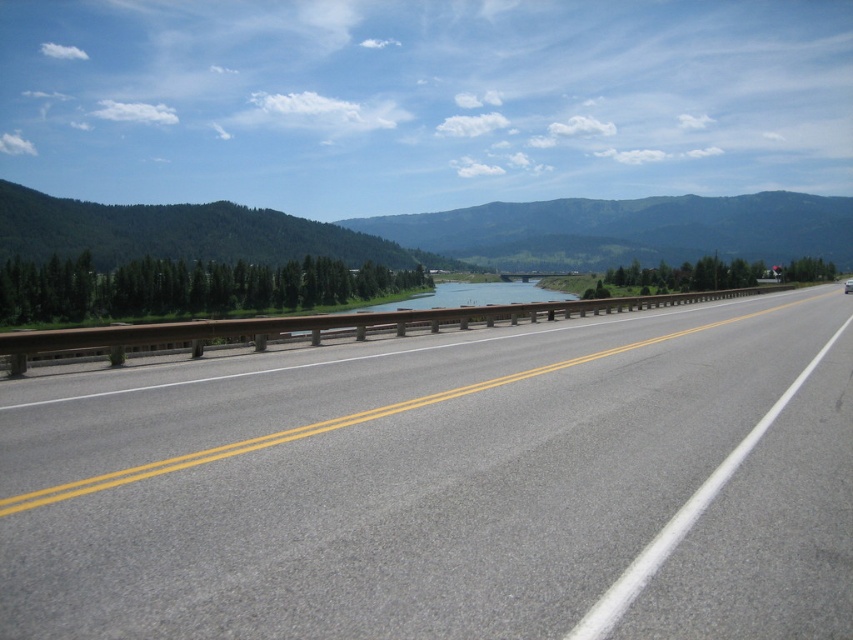
You are a photographer standing on the road and want to capture both the point at coordinates point (833,227) and point (465,310) in your photo. Which point will appear closer to the camera in the final image?

Point (833,227) is further to the viewer than point (465,310), so the point (465,310) will appear closer to the camera in the final image.

You are a driver approaching the green textured mountain at center and the metallic gray bridge at center. Which object will you encounter first?

The green textured mountain at center will be encountered first because the metallic gray bridge at center is positioned behind it.

You are a photographer standing on the road and want to capture both the point at coordinates point (381,484) and the point at coordinates point (271,333) in your photo. Which point should you focus on first to ensure both are in focus?

You should focus on point (381,484) first because it is closer to you than point (271,333), ensuring both points will be in focus when using a proper depth of field.